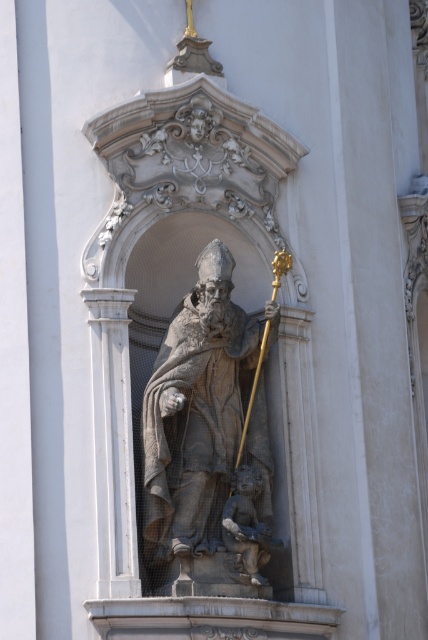
You are standing in front of a building with a gray stone statue at center. If you want to take a photo of the statue from where you are standing, will you need to use a zoom lens to capture the entire statue in the frame?

The gray stone statue at center is 67.16 meters away from the camera. Since this distance is quite far, you would likely need a zoom lens to ensure the entire statue fits within the camera frame.

You are an art student examining the facade of a cathedral. You notice the gray stone statue at center and the smooth stone cherub at lower center. Which object is located higher on the facade?

The gray stone statue at center is positioned over the smooth stone cherub at lower center, so it is higher up on the facade.